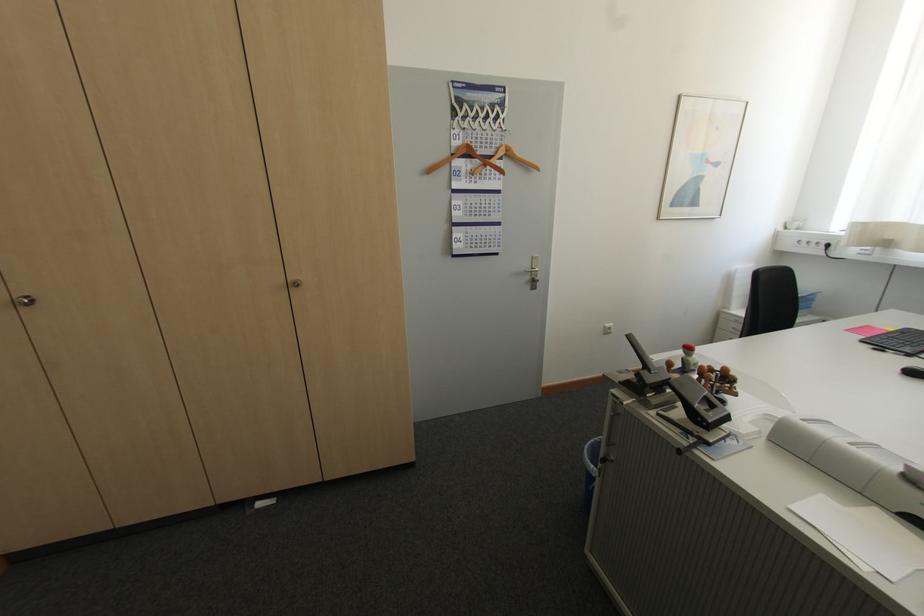
Find where to lift the small wooden stamp. Please return your answer as a coordinate pair (x, y).

(699, 403)